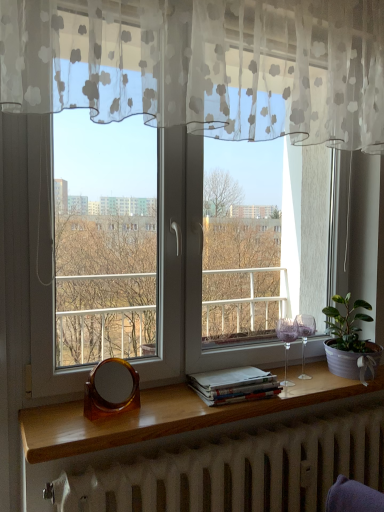
Locate an element on the screen. The height and width of the screenshot is (512, 384). white paper stack at lower center is located at coordinates (234, 385).

Find the location of a particular element. green leafy plant in textured pot at right is located at coordinates click(x=350, y=341).

The width and height of the screenshot is (384, 512). Find the location of `white matte radiator at lower center`. white matte radiator at lower center is located at coordinates (239, 470).

Find the location of a particular element. wooden at lower center is located at coordinates (169, 415).

Visually, is white matte radiator at lower center positioned to the left or to the right of white paper stack at lower center?

Clearly, white matte radiator at lower center is on the right of white paper stack at lower center in the image.

From a real-world perspective, is white matte radiator at lower center under white paper stack at lower center?

Indeed, from a real-world perspective, white matte radiator at lower center is positioned beneath white paper stack at lower center.

Who is more distant, transparent glass window at center or wooden at lower center?

transparent glass window at center is more distant.

Image resolution: width=384 pixels, height=512 pixels. I want to click on window sill on the right of transparent glass window at center, so click(169, 415).

From their relative heights in the image, would you say transparent glass window at center is taller or shorter than wooden at lower center?

Clearly, transparent glass window at center is taller compared to wooden at lower center.

Does white paper stack at lower center turn towards white matte radiator at lower center?

No, white paper stack at lower center is not oriented towards white matte radiator at lower center.

Looking at this image, is white paper stack at lower center bigger or smaller than white matte radiator at lower center?

white paper stack at lower center is smaller than white matte radiator at lower center.

Can we say white paper stack at lower center lies outside white matte radiator at lower center?

Yes, white paper stack at lower center is not within white matte radiator at lower center.

Can you confirm if white paper stack at lower center is thinner than white matte radiator at lower center?

In fact, white paper stack at lower center might be wider than white matte radiator at lower center.

Is white matte radiator at lower center aimed at transparent glass window at center?

No, white matte radiator at lower center does not turn towards transparent glass window at center.

Does point (214, 503) appear closer or farther from the camera than point (278, 131)?

Point (214, 503) is positioned closer to the camera compared to point (278, 131).

Is white matte radiator at lower center outside of transparent glass window at center?

Yes, white matte radiator at lower center is outside of transparent glass window at center.

Consider the image. Is white matte radiator at lower center far away from transparent glass window at center?

No, white matte radiator at lower center is not far away from transparent glass window at center.

Is white matte radiator at lower center facing away from green leafy plant in textured pot at right?

That's not correct — white matte radiator at lower center is not looking away from green leafy plant in textured pot at right.

Which object is closer to the camera, white matte radiator at lower center or green leafy plant in textured pot at right?

white matte radiator at lower center is closer to the camera.

Between white matte radiator at lower center and green leafy plant in textured pot at right, which one appears on the right side from the viewer's perspective?

green leafy plant in textured pot at right.

Which is behind, point (361, 412) or point (381, 348)?

Positioned behind is point (381, 348).

Is brown tortoiseshell mirror at lower center at the back of white paper stack at lower center?

No, white paper stack at lower center is not facing the opposite direction of brown tortoiseshell mirror at lower center.

This screenshot has width=384, height=512. Identify the location of book below the brown tortoiseshell mirror at lower center (from a real-world perspective). (234, 385).

Is the depth of white paper stack at lower center greater than that of brown tortoiseshell mirror at lower center?

Yes, the depth of white paper stack at lower center is greater than that of brown tortoiseshell mirror at lower center.

Is white paper stack at lower center touching brown tortoiseshell mirror at lower center?

They are not placed beside each other.

Is brown tortoiseshell mirror at lower center taller than white paper stack at lower center?

Yes.

From the picture: In the image, is brown tortoiseshell mirror at lower center on the left side or the right side of white paper stack at lower center?

From the image, it's evident that brown tortoiseshell mirror at lower center is to the left of white paper stack at lower center.

Does brown tortoiseshell mirror at lower center have a greater width compared to white paper stack at lower center?

In fact, brown tortoiseshell mirror at lower center might be narrower than white paper stack at lower center.

Is brown tortoiseshell mirror at lower center placed right next to white paper stack at lower center?

No, brown tortoiseshell mirror at lower center is not next to white paper stack at lower center.

The image size is (384, 512). I want to click on book on the left of white matte radiator at lower center, so click(x=234, y=385).

Image resolution: width=384 pixels, height=512 pixels. Identify the location of window lying behind the wooden at lower center. (227, 134).

Considering their positions, is white matte radiator at lower center positioned further to green leafy plant in textured pot at right than white paper stack at lower center?

white paper stack at lower center lies further to green leafy plant in textured pot at right than the other object.

From the image, which object appears to be nearer to brown tortoiseshell mirror at lower center, wooden at lower center or green leafy plant in textured pot at right?

wooden at lower center is closer to brown tortoiseshell mirror at lower center.

Estimate the real-world distances between objects in this image. Which object is further from white matte radiator at lower center, brown tortoiseshell mirror at lower center or white paper stack at lower center?

The object further to white matte radiator at lower center is brown tortoiseshell mirror at lower center.

Estimate the real-world distances between objects in this image. Which object is further from white paper stack at lower center, green leafy plant in textured pot at right or wooden at lower center?

The object further to white paper stack at lower center is green leafy plant in textured pot at right.

Considering their positions, is white matte radiator at lower center positioned closer to wooden at lower center than green leafy plant in textured pot at right?

Based on the image, white matte radiator at lower center appears to be nearer to wooden at lower center.

From the image, which object appears to be farther from wooden at lower center, transparent glass window at center or brown tortoiseshell mirror at lower center?

transparent glass window at center is positioned further to the anchor wooden at lower center.

Which object lies nearer to the anchor point green leafy plant in textured pot at right, wooden at lower center or brown tortoiseshell mirror at lower center?

wooden at lower center.

Estimate the real-world distances between objects in this image. Which object is closer to transparent glass window at center, white matte radiator at lower center or white paper stack at lower center?

white paper stack at lower center lies closer to transparent glass window at center than the other object.

The image size is (384, 512). Find the location of `radiator between brown tortoiseshell mirror at lower center and green leafy plant in textured pot at right from left to right`. radiator between brown tortoiseshell mirror at lower center and green leafy plant in textured pot at right from left to right is located at coordinates (239, 470).

Locate an element on the screen. book between brown tortoiseshell mirror at lower center and wooden at lower center from left to right is located at coordinates (234, 385).

What are the coordinates of `book between transparent glass window at center and green leafy plant in textured pot at right` in the screenshot? It's located at (234, 385).

The image size is (384, 512). In order to click on window sill between white paper stack at lower center and white matte radiator at lower center from top to bottom in this screenshot , I will do (x=169, y=415).